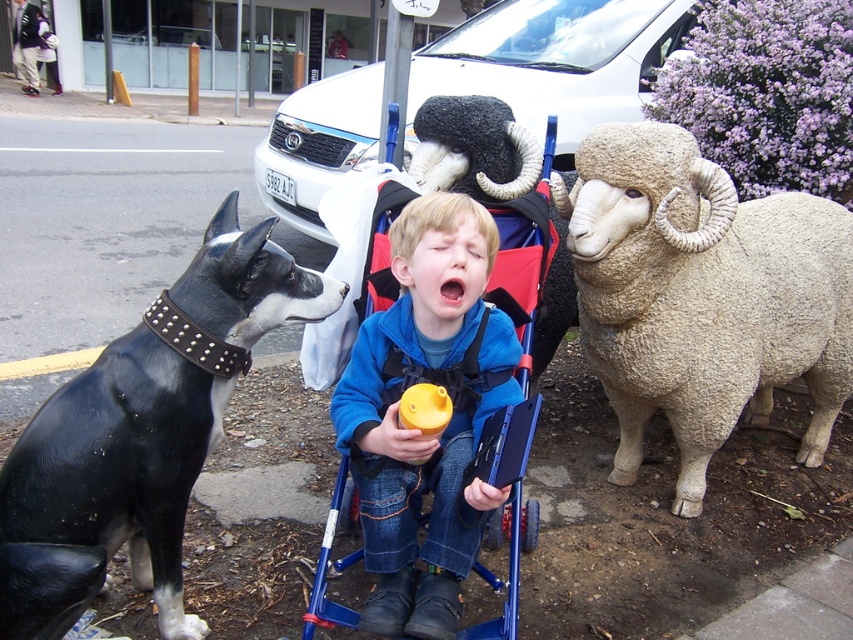
Which is above, white woolen sheep at right or black leather dog at left?

white woolen sheep at right is higher up.

Which is behind, point (788, 337) or point (15, 451)?

Point (788, 337)

Is point (700, 419) positioned after point (125, 460)?

Yes, it is.

Locate an element on the screen. Image resolution: width=853 pixels, height=640 pixels. white woolen sheep at right is located at coordinates (701, 296).

Which of these two, black leather dog at left or blue fleece jacket at center, stands shorter?

With less height is blue fleece jacket at center.

Between point (99, 557) and point (426, 340), which one is positioned in front?

Point (99, 557)

Image resolution: width=853 pixels, height=640 pixels. I want to click on black leather dog at left, so click(x=141, y=435).

In the scene shown: Which of these two, white woolen sheep at right or blue fleece jacket at center, stands shorter?

With less height is blue fleece jacket at center.

Is white woolen sheep at right positioned at the back of blue fleece jacket at center?

Yes, it is behind blue fleece jacket at center.

Find the location of a particular element. Image resolution: width=853 pixels, height=640 pixels. white woolen sheep at right is located at coordinates (701, 296).